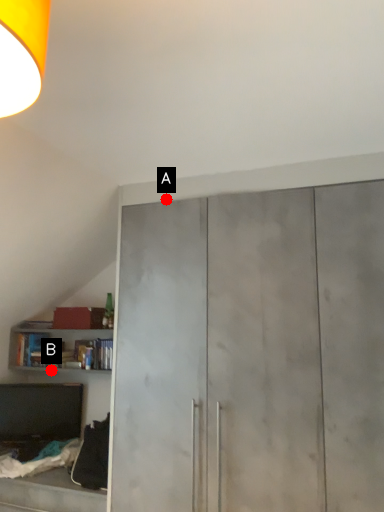
Question: Two points are circled on the image, labeled by A and B beside each circle. Which point is farther to the camera?

Choices:
 (A) A is further
 (B) B is further

Answer: (B)